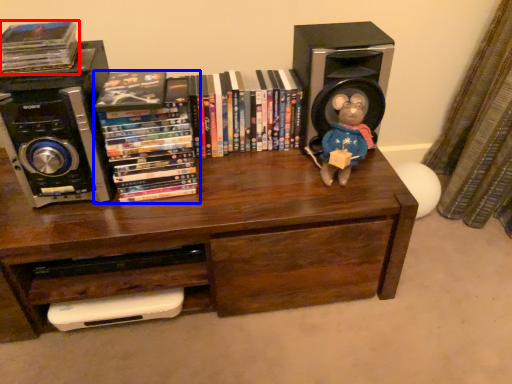
Question: Which of the following is the closest to the observer, book (highlighted by a red box) or book (highlighted by a blue box)?

Choices:
 (A) book
 (B) book

Answer: (A)